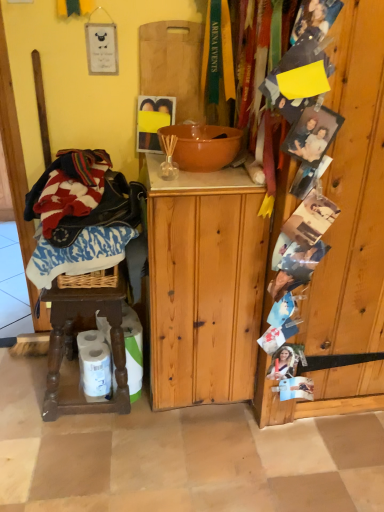
Question: Is wooden photo display at right bigger than white glossy toilet paper at lower left, arranged as the first toilet paper when viewed from the right?

Choices:
 (A) no
 (B) yes

Answer: (B)

Question: Is wooden photo display at right not close to white glossy toilet paper at lower left, arranged as the first toilet paper when viewed from the right?

Choices:
 (A) no
 (B) yes

Answer: (A)

Question: Does wooden photo display at right lie in front of white glossy toilet paper at lower left, arranged as the first toilet paper when viewed from the right?

Choices:
 (A) no
 (B) yes

Answer: (B)

Question: From the image's perspective, is wooden photo display at right below white glossy toilet paper at lower left, arranged as the first toilet paper when viewed from the right?

Choices:
 (A) yes
 (B) no

Answer: (B)

Question: Considering the relative positions of wooden photo display at right and white glossy toilet paper at lower left, arranged as the first toilet paper when viewed from the right, in the image provided, is wooden photo display at right to the left of white glossy toilet paper at lower left, arranged as the first toilet paper when viewed from the right, from the viewer's perspective?

Choices:
 (A) no
 (B) yes

Answer: (A)

Question: Does wooden photo display at right have a greater width compared to white glossy toilet paper at lower left, which is the second toilet paper in left-to-right order?

Choices:
 (A) no
 (B) yes

Answer: (A)

Question: Is natural wood cabinet at center positioned in front of white matte toilet paper at lower left, positioned as the 2th toilet paper in right-to-left order?

Choices:
 (A) yes
 (B) no

Answer: (A)

Question: From the image's perspective, would you say natural wood cabinet at center is shown under white matte toilet paper at lower left, which is the first toilet paper in left-to-right order?

Choices:
 (A) no
 (B) yes

Answer: (A)

Question: From the image's perspective, is natural wood cabinet at center over white matte toilet paper at lower left, which is the first toilet paper in left-to-right order?

Choices:
 (A) no
 (B) yes

Answer: (B)

Question: Are natural wood cabinet at center and white matte toilet paper at lower left, which is the first toilet paper in left-to-right order, located far from each other?

Choices:
 (A) no
 (B) yes

Answer: (A)

Question: From a real-world perspective, is natural wood cabinet at center on white matte toilet paper at lower left, which is the first toilet paper in left-to-right order?

Choices:
 (A) no
 (B) yes

Answer: (B)

Question: Does natural wood cabinet at center come behind white matte toilet paper at lower left, which is the first toilet paper in left-to-right order?

Choices:
 (A) no
 (B) yes

Answer: (A)

Question: Can you confirm if brown wooden stool at lower left is taller than wooden photo display at right?

Choices:
 (A) no
 (B) yes

Answer: (A)